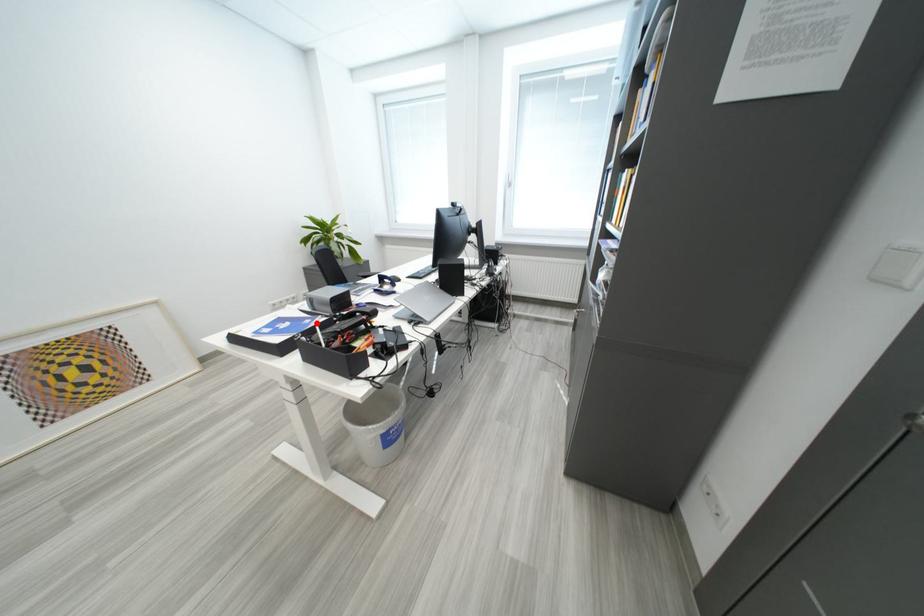
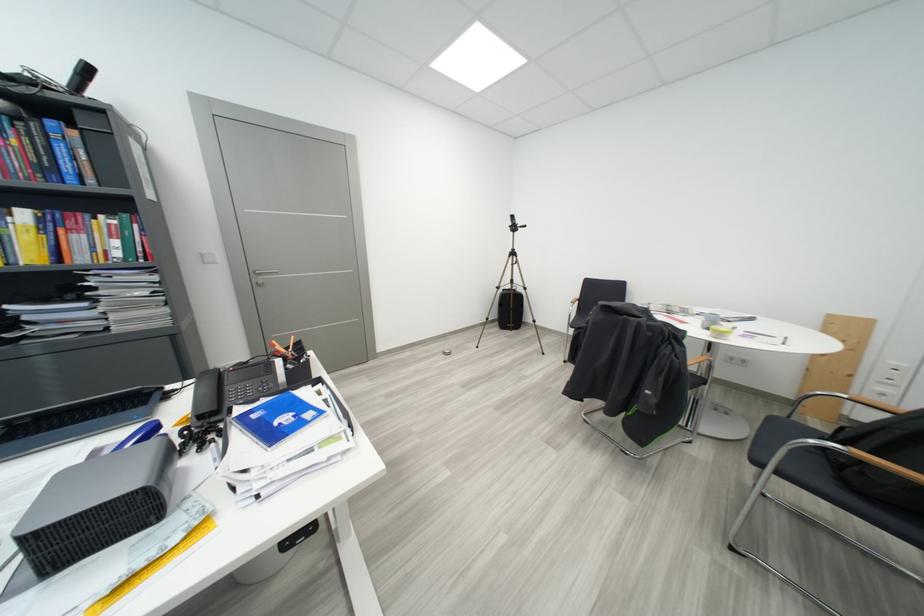
Question: I am providing you with two images of the same scene from different viewpoints. A red point is marked on the first image. Can you still see the location of the red point in image 2?

Choices:
 (A) Yes
 (B) No

Answer: (A)